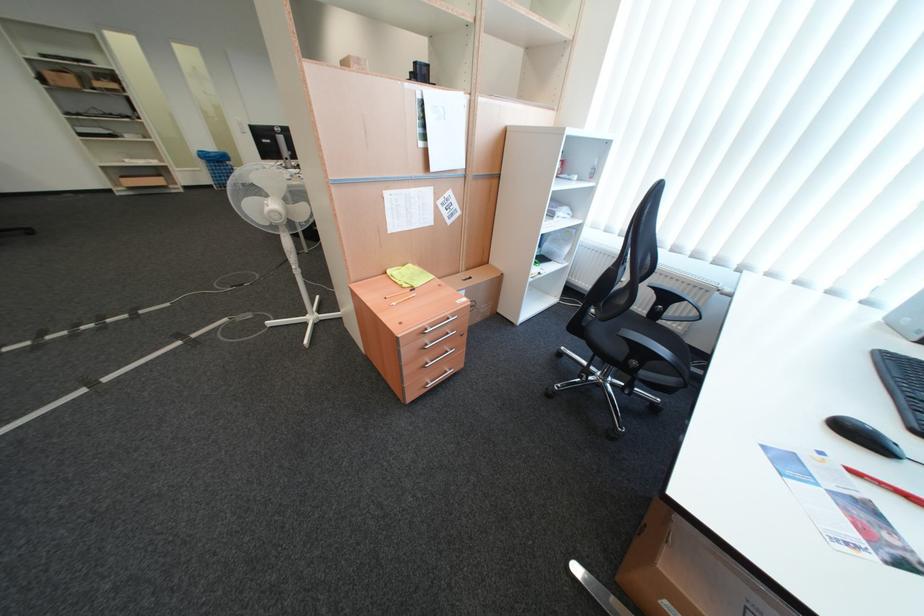
This screenshot has height=616, width=924. What do you see at coordinates (642, 321) in the screenshot?
I see `a chair sitting surface` at bounding box center [642, 321].